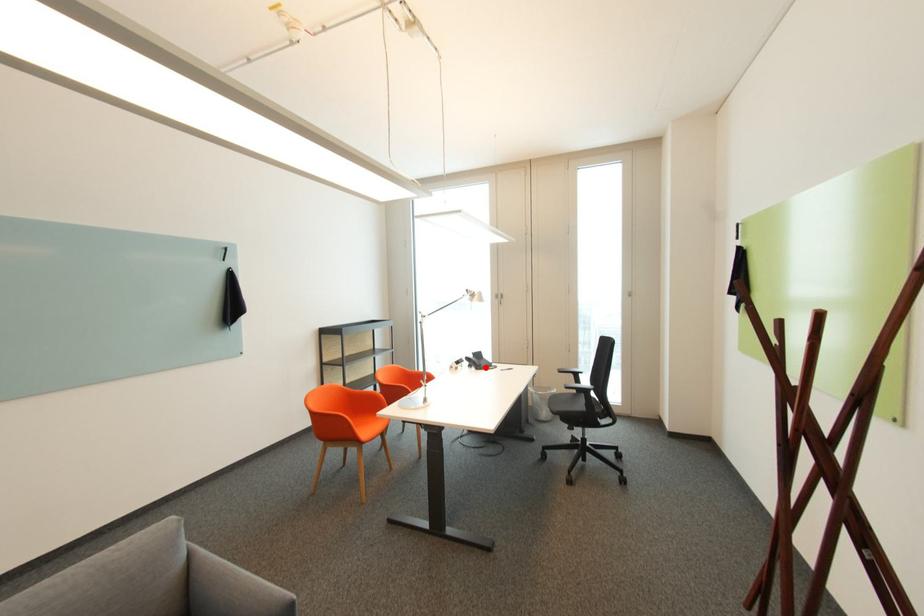
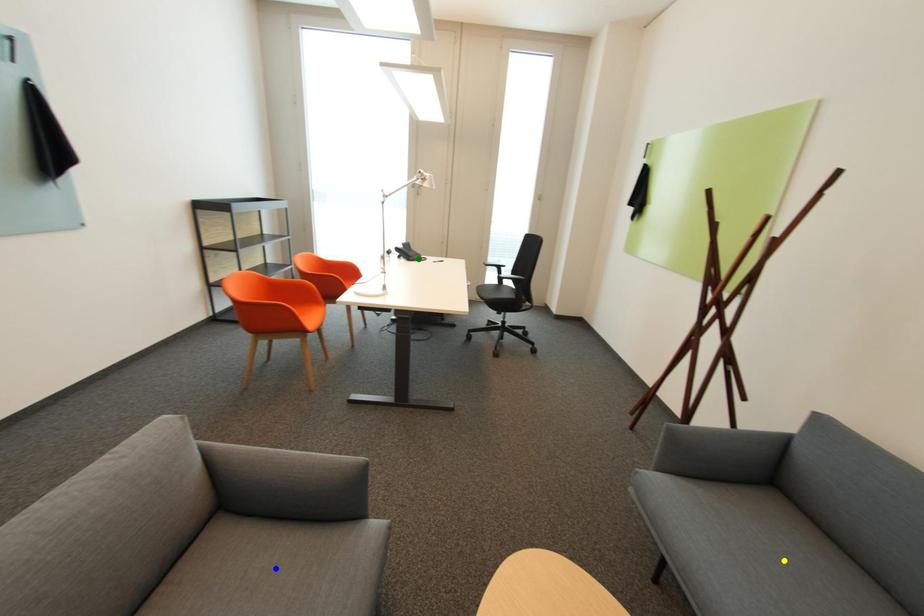
Question: I am providing you with two images of the same scene from different viewpoints. A red point is marked on the first image. You are given multiple points on the second image. In image 2, which mark is for the same physical point as the one in image 1?

Choices:
 (A) green point
 (B) blue point
 (C) yellow point

Answer: (A)